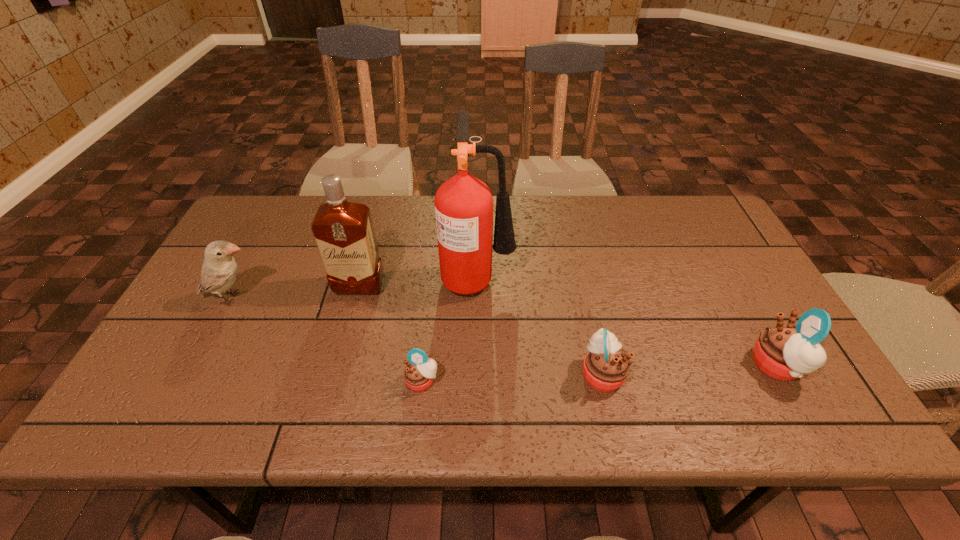
The height and width of the screenshot is (540, 960). What are the coordinates of `free space that satisfies the following two spatial constraints: 1. at the nozzle of the tallest object; 2. on the front label of the fifth object from right to left` in the screenshot? It's located at (478, 286).